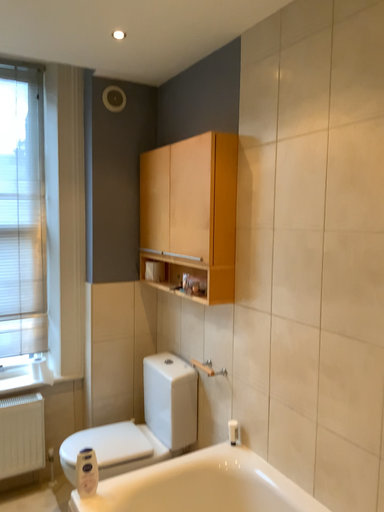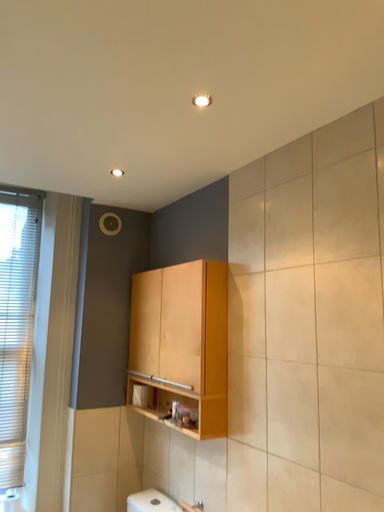
Question: How did the camera likely rotate when shooting the video?

Choices:
 (A) rotated downward
 (B) rotated upward

Answer: (B)